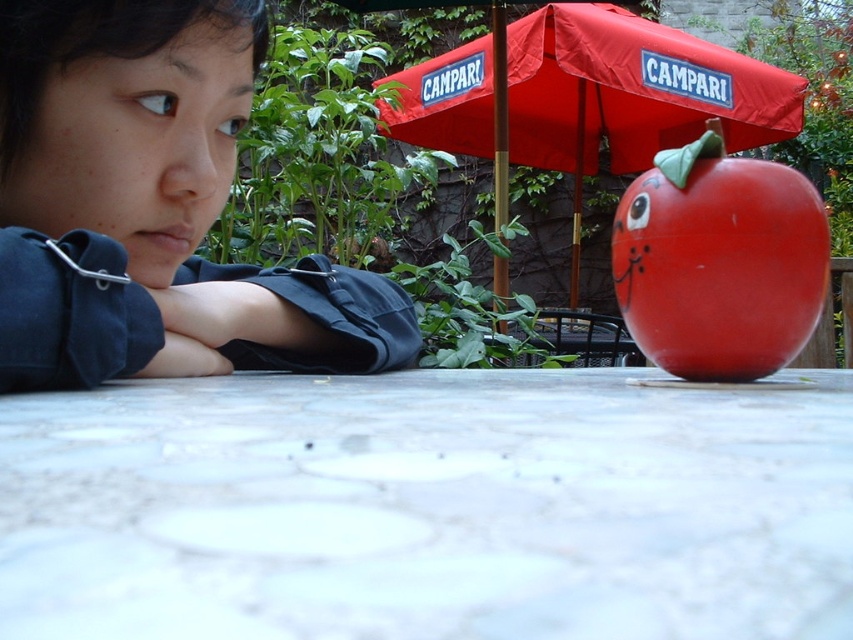
Looking at this image, you are a delivery person who needs to place a package on the table. The package is 10 inches wide. Is there enough space between the white marble table at lower center and the glossy plastic apple at center to place the package?

The distance between the white marble table at lower center and the glossy plastic apple at center is 12.74 inches, which is wider than the package width of 10 inches. Yes, there is enough space to place the package between them.

You are a customer sitting at the white marble table at lower center. You want to order a drink from the server who is standing under the red fabric umbrella at upper center. Can you see the server clearly from your seat?

The white marble table at lower center is below the red fabric umbrella at upper center, so you are positioned under the umbrella. This means the server standing under the same umbrella would be directly above you, making it easy to see them clearly.